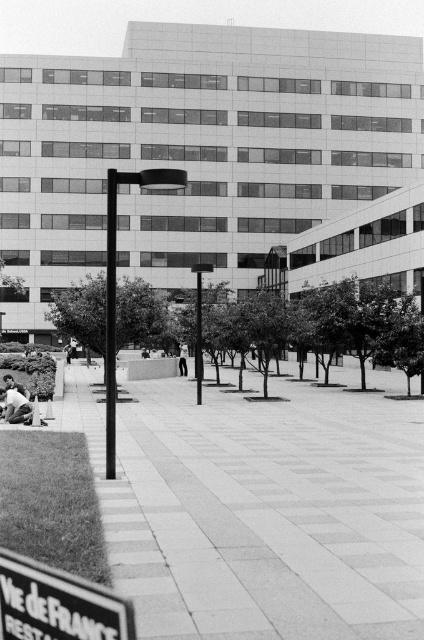
You are standing at the edge of the scene and see the smooth concrete pavement at center and the light skin tone human at lower left. Which object is closer to you?

The light skin tone human at lower left is closer to you because the smooth concrete pavement at center is to the right of the human, indicating it is further away.

You are standing at the camera position looking at the walkway leading to the building. There are two points marked on the walkway. One is at point (38, 604) and the other is at point (25, 419). Which point is closer to you?

The point at (38, 604) is closer to you because it is nearer to the camera position compared to the point at (25, 419).